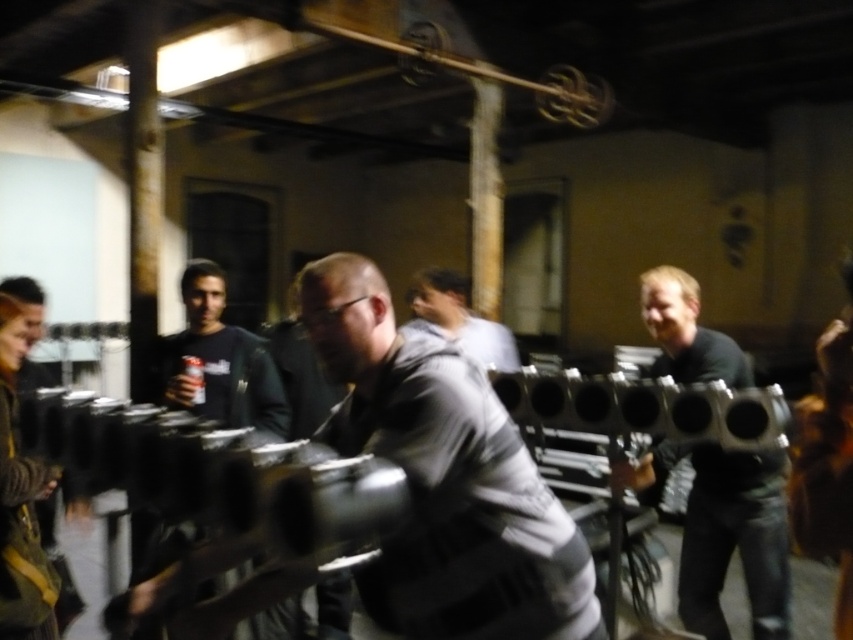
Based on the scene description, can you determine if the black matte helmet at center is wider than the black matte shirt at center?

The black matte helmet at center might be wider than black matte shirt at center according to the description.